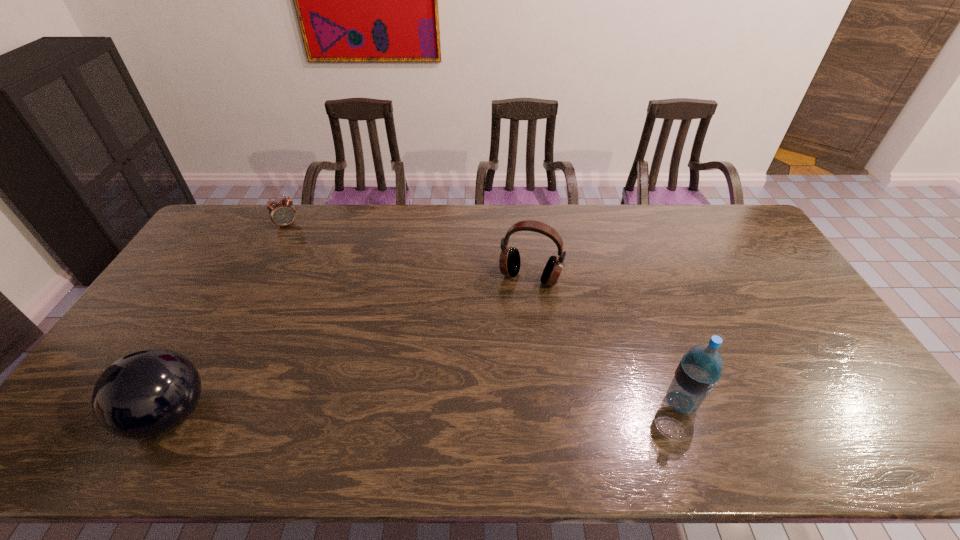
Where is `object that is positioned at the near left corner`? The height and width of the screenshot is (540, 960). object that is positioned at the near left corner is located at coordinates coord(145,394).

You are a GUI agent. You are given a task and a screenshot of the screen. Output one action in this format:
    pyautogui.click(x=<x>, y=<y>)
    Task: Click on the free space at the far edge
    This screenshot has height=540, width=960.
    Given the screenshot: What is the action you would take?
    pyautogui.click(x=567, y=205)

Locate an element on the screen. This screenshot has height=540, width=960. free space at the near edge is located at coordinates (474, 393).

In the image, there is a desktop. In order to click on free space at the left edge in this screenshot , I will do `click(188, 298)`.

This screenshot has width=960, height=540. In the image, there is a desktop. In order to click on free space at the far left corner in this screenshot , I will do `click(209, 238)`.

The image size is (960, 540). In the image, there is a desktop. Identify the location of blank space at the far right corner. pos(742,231).

You are a GUI agent. You are given a task and a screenshot of the screen. Output one action in this format:
    pyautogui.click(x=<x>, y=<y>)
    Task: Click on the vacant area that lies between the headset and the water bottle
    
    Given the screenshot: What is the action you would take?
    [x=605, y=340]

The image size is (960, 540). I want to click on vacant space that is in between the second farthest object and the farthest object, so click(x=408, y=251).

Find the location of a particular element. This screenshot has height=540, width=960. free space between the bowling ball and the shortest object is located at coordinates (228, 320).

The height and width of the screenshot is (540, 960). I want to click on vacant area that lies between the headset and the farthest object, so click(x=408, y=251).